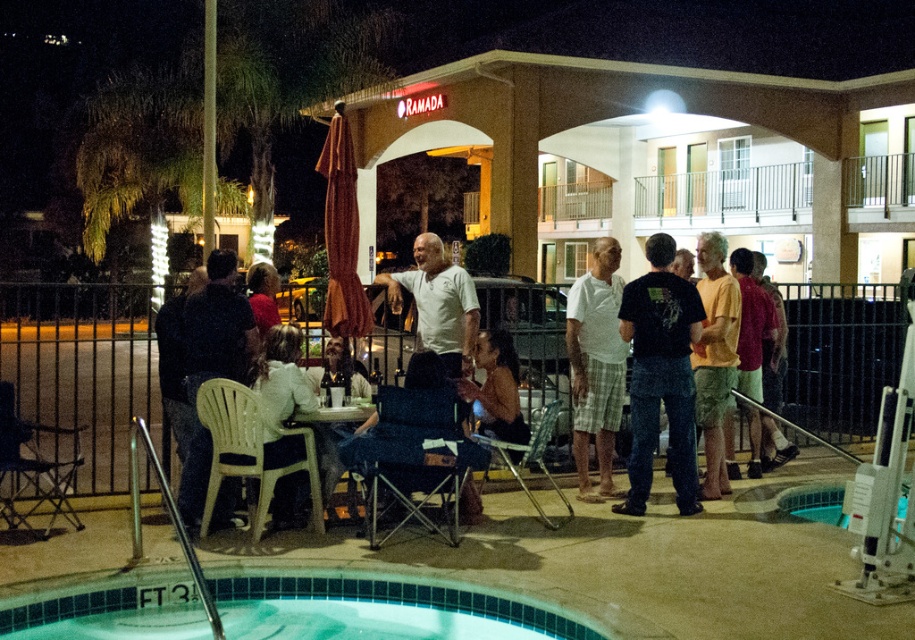
Is point (750, 380) positioned before point (569, 337)?

No.

Who is lower down, matte white chair at center or white plaid shorts at center?

white plaid shorts at center

Between point (651, 304) and point (617, 337), which one is positioned behind?

Positioned behind is point (617, 337).

Locate an element on the screen. The image size is (915, 640). matte white chair at center is located at coordinates (659, 365).

Who is positioned more to the left, black cotton t-shirt at center or white plaid shorts at center?

white plaid shorts at center

Who is more forward, (654,394) or (577,344)?

Point (654,394) is in front.

Where is `black cotton t-shirt at center`? The width and height of the screenshot is (915, 640). black cotton t-shirt at center is located at coordinates (660, 374).

Image resolution: width=915 pixels, height=640 pixels. I want to click on black cotton t-shirt at center, so click(660, 374).

Does matte white chair at center appear under dark blue jeans at lower left?

Incorrect, matte white chair at center is not positioned below dark blue jeans at lower left.

Who is positioned more to the left, matte white chair at center or dark blue jeans at lower left?

dark blue jeans at lower left is more to the left.

Is point (692, 420) behind point (225, 289)?

Yes, point (692, 420) is farther from viewer.

Where is `matte white chair at center`? Image resolution: width=915 pixels, height=640 pixels. matte white chair at center is located at coordinates (659, 365).